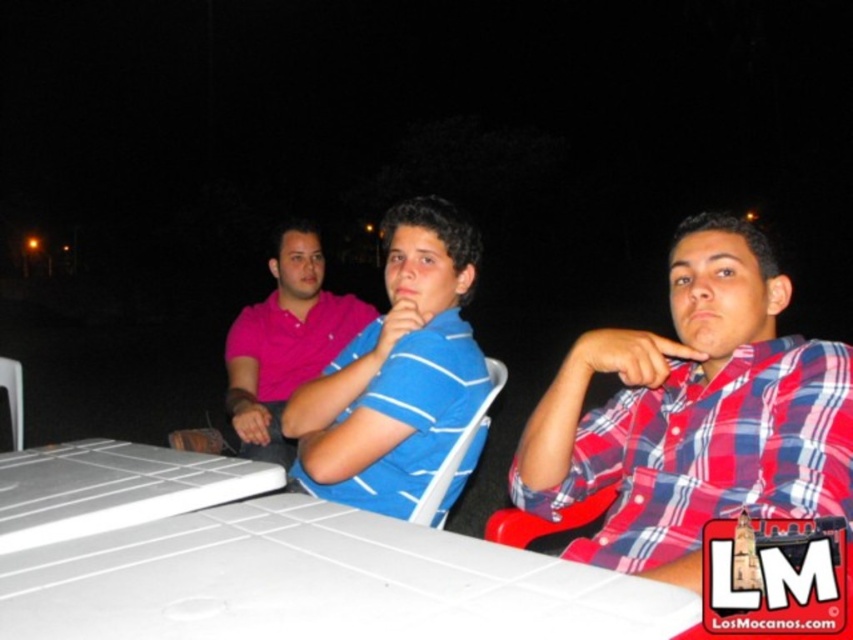
Question: Based on their relative distances, which object is nearer to the white plastic table at center?

Choices:
 (A) blue striped shirt at center
 (B) red plaid shirt at center
 (C) white plastic laptop at lower left

Answer: (C)

Question: Is white plastic table at center below white plastic laptop at lower left?

Choices:
 (A) yes
 (B) no

Answer: (A)

Question: Is white plastic table at center smaller than red plaid shirt at center?

Choices:
 (A) yes
 (B) no

Answer: (A)

Question: Among these objects, which one is nearest to the camera?

Choices:
 (A) white plastic laptop at lower left
 (B) white plastic table at center

Answer: (B)

Question: Which of the following is the closest to the observer?

Choices:
 (A) red plaid shirt at center
 (B) white plastic laptop at lower left

Answer: (A)

Question: Is white plastic table at center further to camera compared to pink cotton polo shirt at center?

Choices:
 (A) yes
 (B) no

Answer: (B)